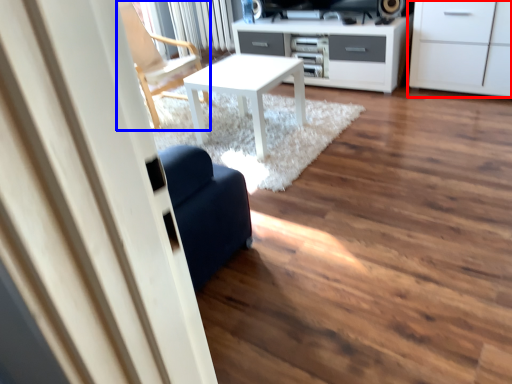
Question: Which of the following is the closest to the observer, cabinetry (highlighted by a red box) or chair (highlighted by a blue box)?

Choices:
 (A) cabinetry
 (B) chair

Answer: (A)